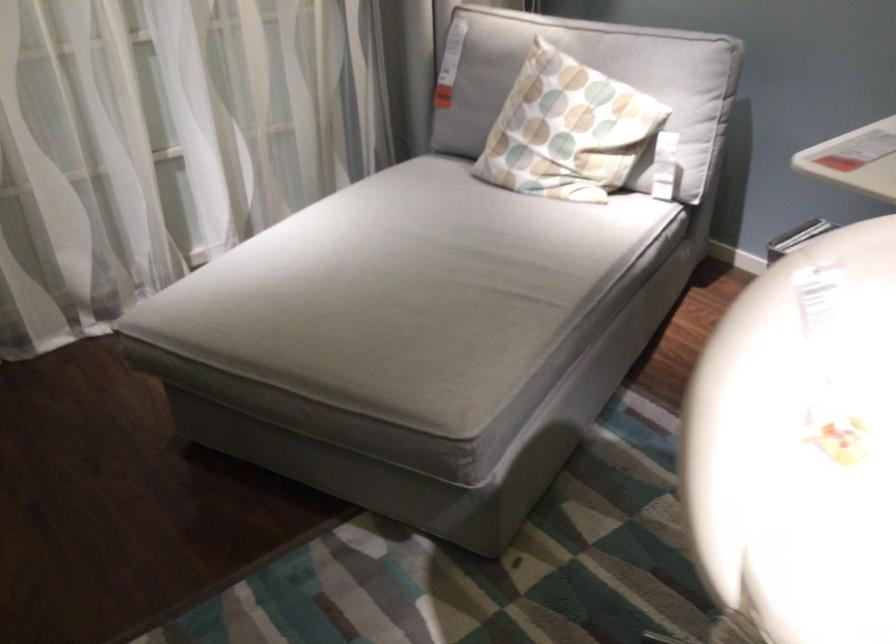
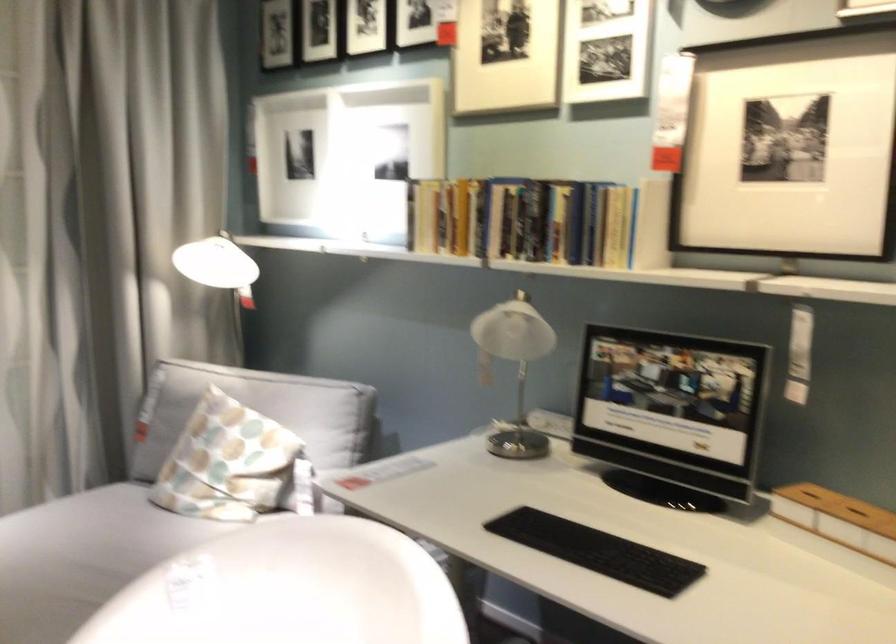
Question: The images are taken continuously from a first-person perspective. In which direction is your viewpoint rotating?

Choices:
 (A) Left
 (B) Right
 (C) Up
 (D) Down

Answer: (C)